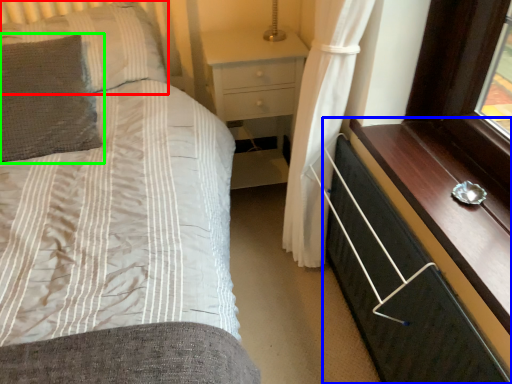
Question: Considering the real-world distances, which object is farthest from pillow (highlighted by a red box)? chest of drawers (highlighted by a blue box) or pillow (highlighted by a green box)?

Choices:
 (A) chest of drawers
 (B) pillow

Answer: (A)